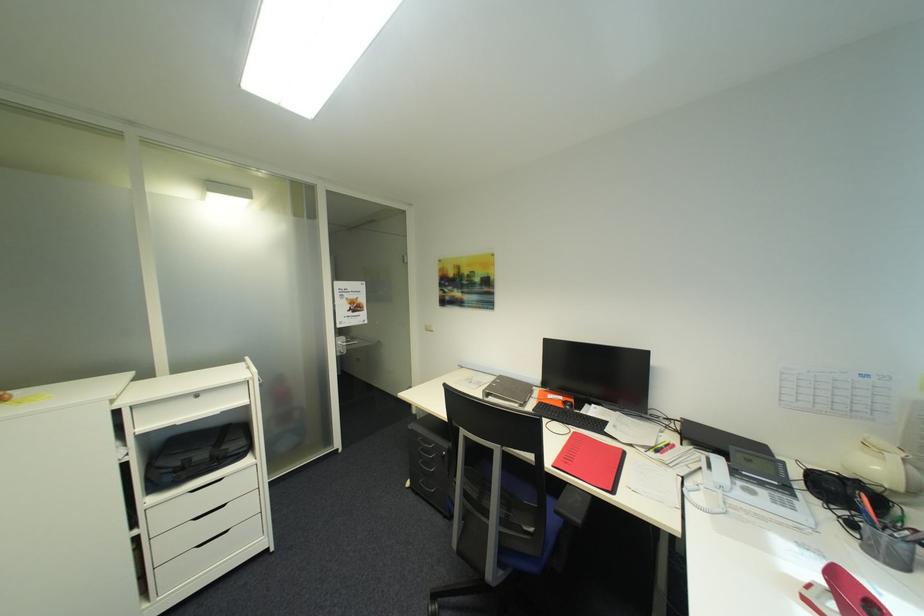
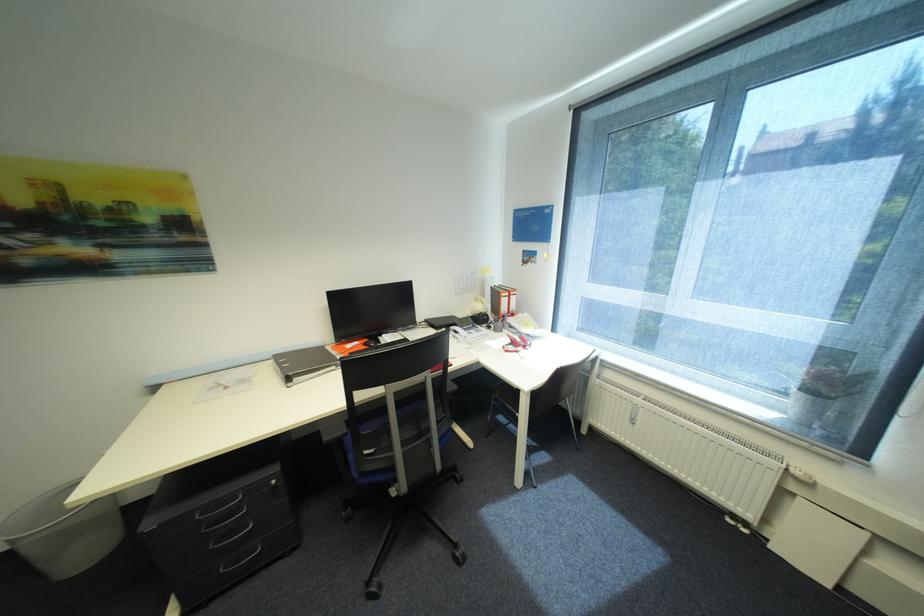
Where in the second image is the point corresponding to the point at 497,398 from the first image?

(304, 379)